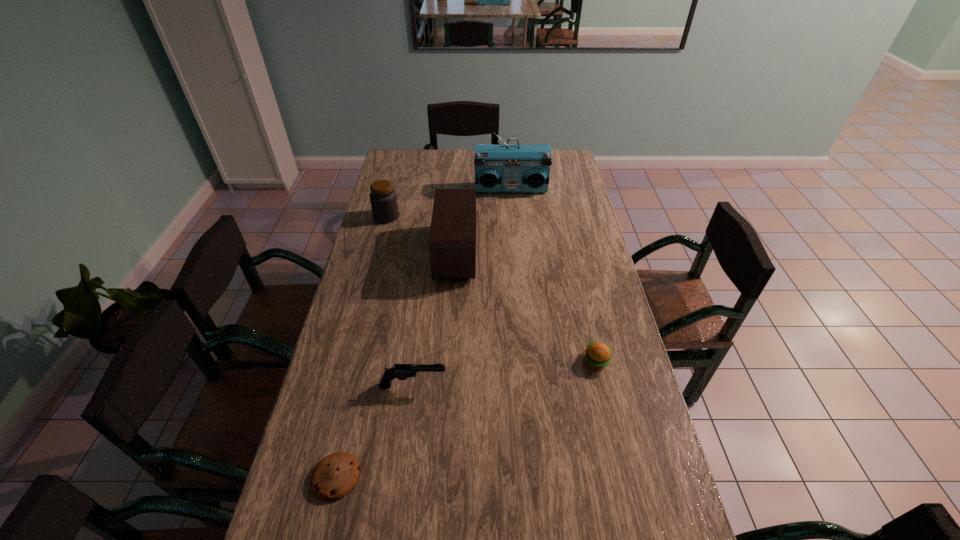
Find the location of a particular element. The height and width of the screenshot is (540, 960). cookie situated at the left edge is located at coordinates (334, 476).

Find the location of `radio receiver that is at the right edge`. radio receiver that is at the right edge is located at coordinates (498, 168).

The height and width of the screenshot is (540, 960). In order to click on hamburger situated at the right edge in this screenshot , I will do `click(598, 355)`.

Find the location of a particular element. vacant point at the far edge is located at coordinates (439, 171).

Image resolution: width=960 pixels, height=540 pixels. Identify the location of vacant space at the left edge of the desktop. (378, 358).

I want to click on blank area at the right edge, so click(x=568, y=207).

Image resolution: width=960 pixels, height=540 pixels. I want to click on vacant space at the far right corner, so click(x=561, y=168).

Find the location of a particular element. This screenshot has height=540, width=960. unoccupied area between the farther radio receiver and the second nearest object is located at coordinates (462, 287).

Where is `vacant space in between the fifth shortest object and the taller radio receiver`? vacant space in between the fifth shortest object and the taller radio receiver is located at coordinates (483, 221).

The height and width of the screenshot is (540, 960). Find the location of `vacant point located between the second tallest object and the taller radio receiver`. vacant point located between the second tallest object and the taller radio receiver is located at coordinates (483, 221).